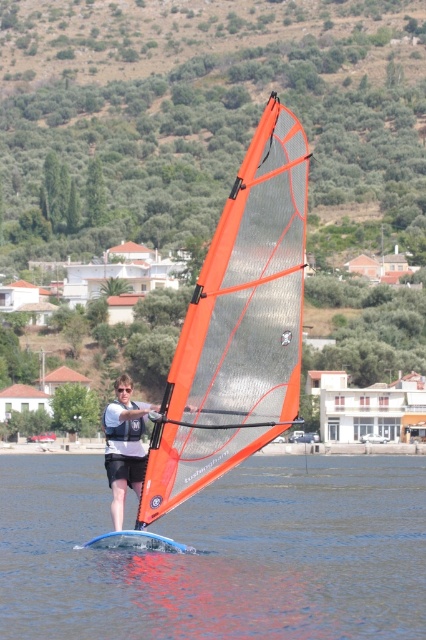
Who is more forward, [229,442] or [141,451]?

Positioned in front is point [229,442].

Who is taller, orange mesh sail at center or matte white windsurfing board at center?

With more height is orange mesh sail at center.

Which is behind, point (241, 278) or point (132, 483)?

Positioned behind is point (132, 483).

Locate an element on the screen. This screenshot has height=640, width=426. orange mesh sail at center is located at coordinates (233, 333).

Find the location of `transparent blue windsurf board at center`. transparent blue windsurf board at center is located at coordinates (219, 554).

Measure the distance between transparent blue windsurf board at center and camera.

transparent blue windsurf board at center and camera are 91.85 feet apart from each other.

Identify the location of transparent blue windsurf board at center. pos(219,554).

Identify the location of transparent blue windsurf board at center. The image size is (426, 640). (219, 554).

Which is below, transparent blue windsurf board at center or matte white windsurfing board at center?

transparent blue windsurf board at center is below.

Identify the location of transparent blue windsurf board at center. This screenshot has width=426, height=640. (219, 554).